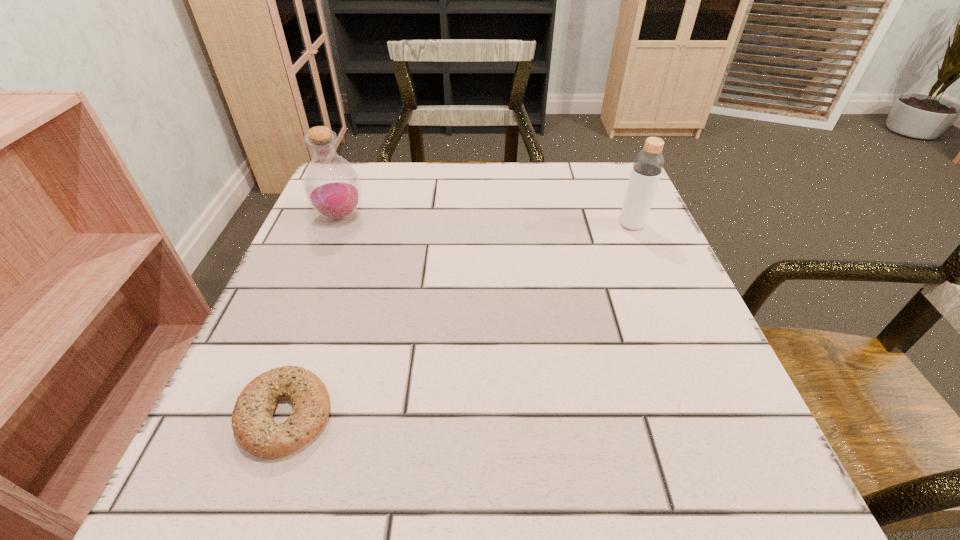
Locate an element on the screen. the second closest object to the right bottle is located at coordinates (252, 421).

Find the location of a particular element. object that is the closest to the nearest object is located at coordinates (332, 187).

Find the location of a particular element. This screenshot has width=960, height=540. vacant position in the image that satisfies the following two spatial constraints: 1. on the back side of the shortest object; 2. on the left side of the right bottle is located at coordinates (353, 225).

Locate an element on the screen. free spot that satisfies the following two spatial constraints: 1. on the front side of the rightmost object; 2. on the left side of the left bottle is located at coordinates (337, 225).

Where is `free space that satisfies the following two spatial constraints: 1. on the front side of the left bottle; 2. on the left side of the shortest object`? The width and height of the screenshot is (960, 540). free space that satisfies the following two spatial constraints: 1. on the front side of the left bottle; 2. on the left side of the shortest object is located at coordinates point(261,416).

Identify the location of free space that satisfies the following two spatial constraints: 1. on the front side of the shortest object; 2. on the right side of the left bottle. (261, 416).